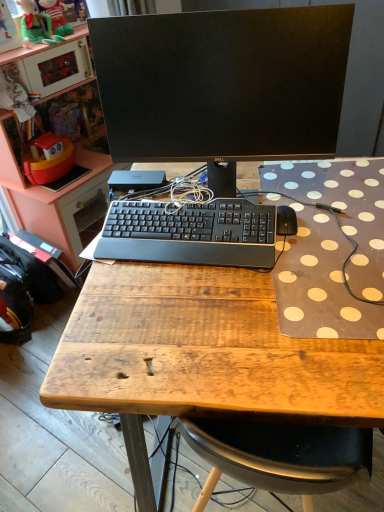
Question: From a real-world perspective, is black matte monitor at center on top of black fabric backpack at lower left, acting as the second backpack starting from the front?

Choices:
 (A) yes
 (B) no

Answer: (A)

Question: Would you say black matte monitor at center contains black fabric backpack at lower left, acting as the second backpack starting from the front?

Choices:
 (A) yes
 (B) no

Answer: (B)

Question: Is black matte monitor at center placed right next to black fabric backpack at lower left, which is counted as the 1th backpack, starting from the back?

Choices:
 (A) no
 (B) yes

Answer: (A)

Question: Does black matte monitor at center lie behind black fabric backpack at lower left, acting as the second backpack starting from the front?

Choices:
 (A) yes
 (B) no

Answer: (B)

Question: Is black matte monitor at center positioned beyond the bounds of black fabric backpack at lower left, acting as the second backpack starting from the front?

Choices:
 (A) yes
 (B) no

Answer: (A)

Question: In the image, is black matte keyboard at center positioned in front of or behind black fabric backpack at lower left, acting as the second backpack starting from the front?

Choices:
 (A) behind
 (B) front

Answer: (B)

Question: From a real-world perspective, is black matte keyboard at center physically located above or below black fabric backpack at lower left, acting as the second backpack starting from the front?

Choices:
 (A) above
 (B) below

Answer: (A)

Question: In terms of width, does black matte keyboard at center look wider or thinner when compared to black fabric backpack at lower left, which is counted as the 1th backpack, starting from the back?

Choices:
 (A) wide
 (B) thin

Answer: (A)

Question: Which is correct: black matte keyboard at center is inside black fabric backpack at lower left, acting as the second backpack starting from the front, or outside of it?

Choices:
 (A) outside
 (B) inside

Answer: (A)

Question: Is black leather backpack at lower left, which is the second backpack in back-to-front order, to the left or to the right of black fabric backpack at lower left, acting as the second backpack starting from the front, in the image?

Choices:
 (A) right
 (B) left

Answer: (B)

Question: From the image's perspective, is black leather backpack at lower left, which is the second backpack in back-to-front order, above or below black fabric backpack at lower left, acting as the second backpack starting from the front?

Choices:
 (A) below
 (B) above

Answer: (A)

Question: Is black leather backpack at lower left, which appears as the first backpack when viewed from the front, inside the boundaries of black fabric backpack at lower left, which is counted as the 1th backpack, starting from the back, or outside?

Choices:
 (A) outside
 (B) inside

Answer: (A)

Question: Is point (1, 327) positioned closer to the camera than point (56, 300)?

Choices:
 (A) closer
 (B) farther

Answer: (A)

Question: Considering the positions of black matte mouse at right and black fabric backpack at lower left, acting as the second backpack starting from the front, in the image, is black matte mouse at right taller or shorter than black fabric backpack at lower left, acting as the second backpack starting from the front,?

Choices:
 (A) short
 (B) tall

Answer: (A)

Question: Is black matte mouse at right situated inside black fabric backpack at lower left, which is counted as the 1th backpack, starting from the back, or outside?

Choices:
 (A) outside
 (B) inside

Answer: (A)